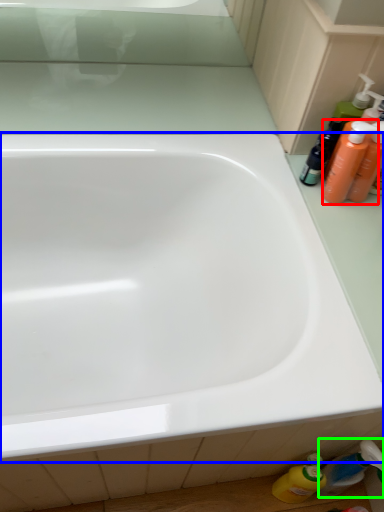
Question: Considering the real-world distances, which object is closest to cleaning product (highlighted by a red box)? bathtub (highlighted by a blue box) or toiletry (highlighted by a green box).

Choices:
 (A) bathtub
 (B) toiletry

Answer: (A)